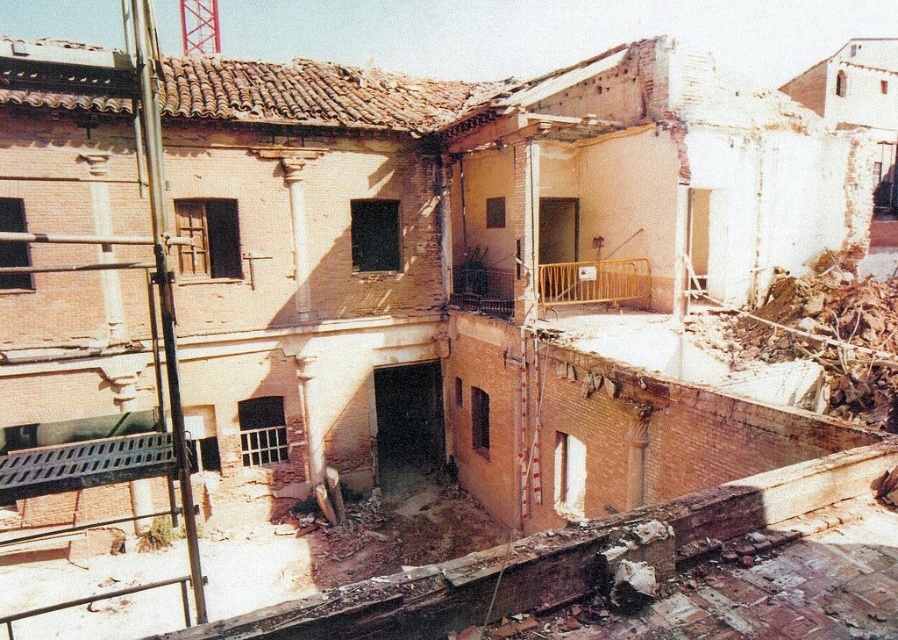
You are a rescue worker assessing the stability of the damaged building. You notice a metallic grid at lower left and a yellow metallic railing at center. Which of these two objects takes up more space in the image?

The yellow metallic railing at center occupies more space than the metallic grid at lower left.

You are a rescue worker assessing the damaged building. You notice the metallic grid at lower left and the yellow metallic railing at center. Which object is closer to you as you approach the building from the front?

The metallic grid at lower left is closer to you because it is in front of the yellow metallic railing at center.

You are a rescue worker trying to reach the yellow metallic railing at center from the metallic grid at lower left. The safe distance for your equipment to operate is up to 8 meters. Can you safely operate your equipment to reach the railing from the grid?

The metallic grid at lower left is 8.49 meters away from the yellow metallic railing at center. Since the safe distance is up to 8 meters, operating the equipment from the metallic grid at lower left to reach the yellow metallic railing at center exceeds the safe limit. Therefore, it is not safe to operate the equipment in this scenario.